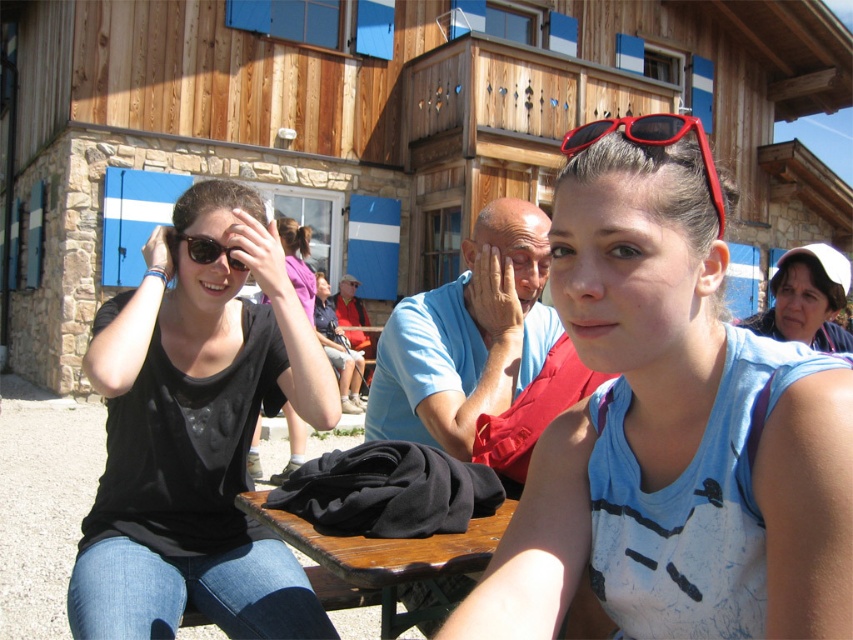
Does black matte shirt at left have a lesser width compared to wooden picnic table at center?

No, black matte shirt at left is not thinner than wooden picnic table at center.

Which of these two, black matte shirt at left or wooden picnic table at center, stands shorter?

Standing shorter between the two is wooden picnic table at center.

Which is behind, point (109, 438) or point (467, 541)?

The point (109, 438) is more distant.

I want to click on black matte shirt at left, so click(196, 435).

Is black matte shirt at left above matte black sunglasses at upper left?

No, black matte shirt at left is not above matte black sunglasses at upper left.

Measure the distance between black matte shirt at left and camera.

black matte shirt at left and camera are 1.93 meters apart.

Locate an element on the screen. The image size is (853, 640). black matte shirt at left is located at coordinates (196, 435).

The width and height of the screenshot is (853, 640). What are the coordinates of `blue cotton tank top at center` in the screenshot? It's located at (670, 428).

How much distance is there between blue cotton tank top at center and matte white hat at upper right?

blue cotton tank top at center and matte white hat at upper right are 2.43 meters apart from each other.

Is point (453, 627) less distant than point (766, 316)?

Yes, it is.

Where is `blue cotton tank top at center`? This screenshot has height=640, width=853. blue cotton tank top at center is located at coordinates (670, 428).